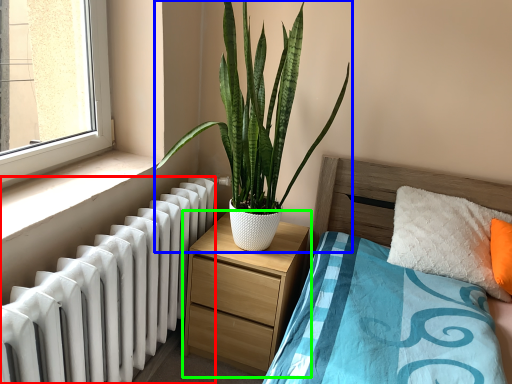
Question: Which object is positioned farthest from radiator (highlighted by a red box)? Select from houseplant (highlighted by a blue box) and nightstand (highlighted by a green box).

Choices:
 (A) houseplant
 (B) nightstand

Answer: (A)